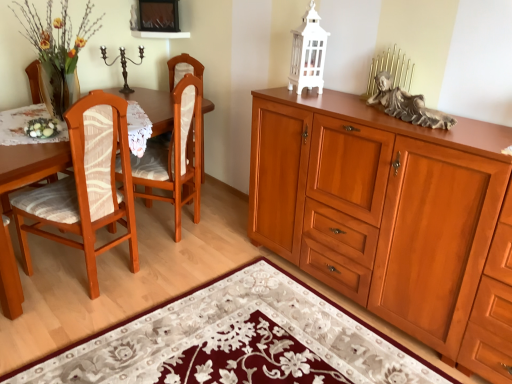
Find the location of a particular element. The width and height of the screenshot is (512, 384). free spot in front of wooden chair at left, which is the 2th chair from front to back is located at coordinates (169, 261).